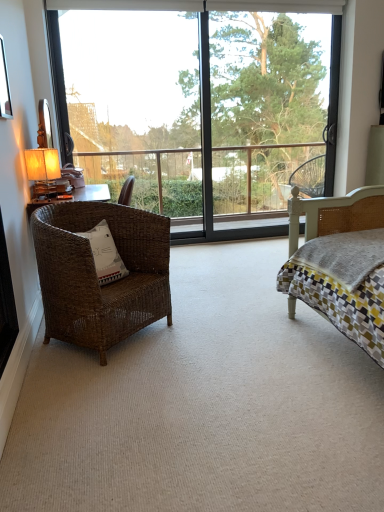
Question: Looking at their shapes, would you say green leafy tree at upper center is wider or thinner than metallic silver picture frame at upper left?

Choices:
 (A) thin
 (B) wide

Answer: (B)

Question: From a real-world perspective, relative to metallic silver picture frame at upper left, is green leafy tree at upper center vertically above or below?

Choices:
 (A) below
 (B) above

Answer: (A)

Question: Which is farther from the green leafy tree at upper center?

Choices:
 (A) brown wicker chair at left
 (B) matte yellow fabric at left
 (C) white cotton pillow at left
 (D) transparent glass window at center
 (E) metallic silver picture frame at upper left

Answer: (C)

Question: Which object is the closest to the metallic silver picture frame at upper left?

Choices:
 (A) transparent glass window at center
 (B) green leafy tree at upper center
 (C) brown wicker chair at left
 (D) white cotton pillow at left
 (E) matte yellow fabric at left

Answer: (E)